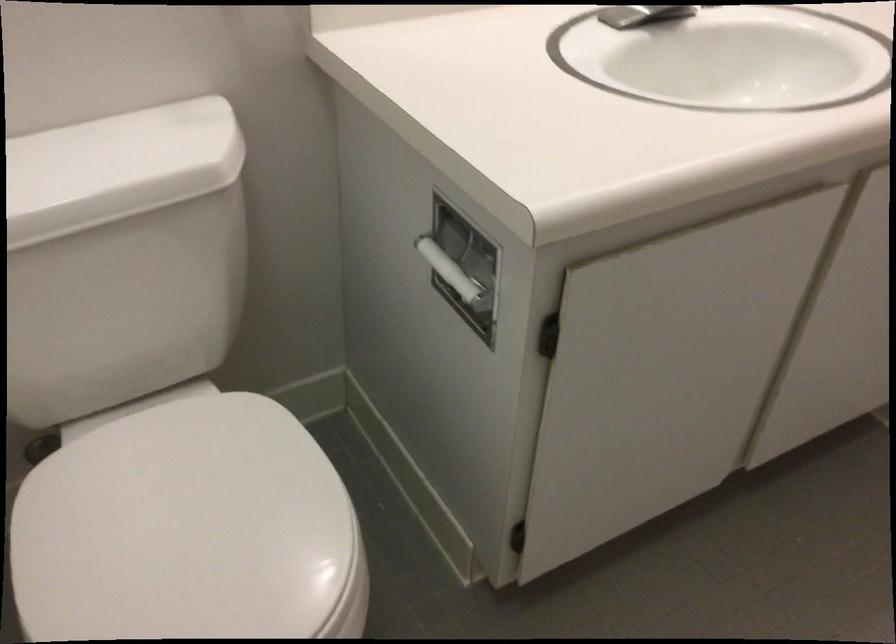
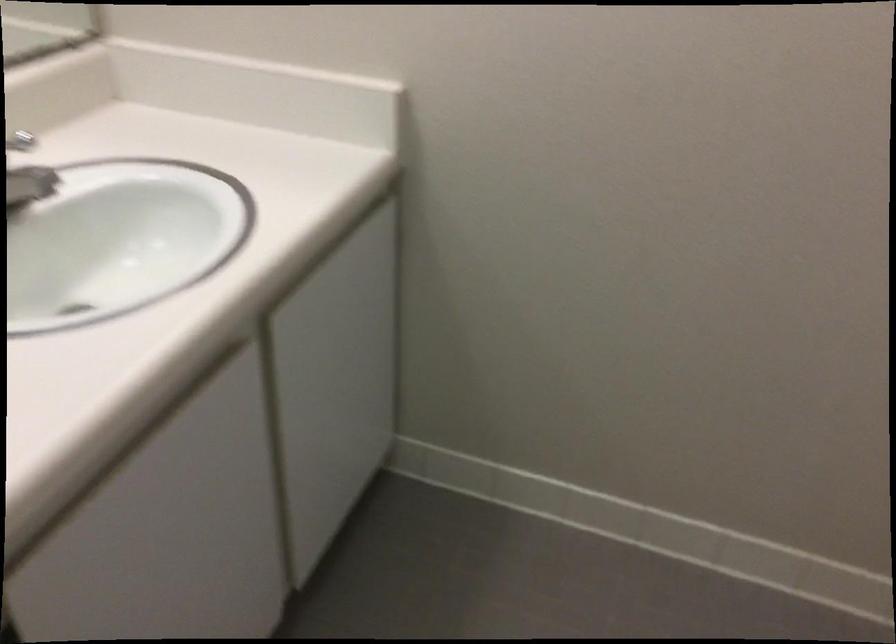
Question: The first image is from the beginning of the video and the second image is from the end. How did the camera likely rotate when shooting the video?

Choices:
 (A) Left
 (B) Right
 (C) Up
 (D) Down

Answer: (B)